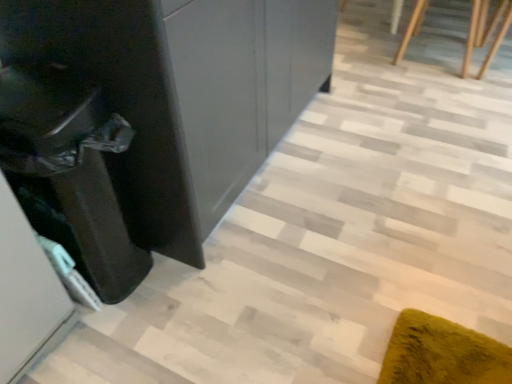
Question: Does glossy black dresser at left have a lesser height compared to wooden staircase at upper right?

Choices:
 (A) no
 (B) yes

Answer: (A)

Question: Does glossy black dresser at left turn towards wooden staircase at upper right?

Choices:
 (A) no
 (B) yes

Answer: (A)

Question: Is glossy black dresser at left closer to the viewer compared to wooden staircase at upper right?

Choices:
 (A) yes
 (B) no

Answer: (A)

Question: Is glossy black dresser at left positioned with its back to wooden staircase at upper right?

Choices:
 (A) yes
 (B) no

Answer: (B)

Question: Could wooden staircase at upper right be considered to be inside glossy black dresser at left?

Choices:
 (A) yes
 (B) no

Answer: (B)

Question: Considering the positions of point (68, 216) and point (51, 72), is point (68, 216) closer or farther from the camera than point (51, 72)?

Choices:
 (A) closer
 (B) farther

Answer: (B)

Question: Is black glossy cabinet at left wider or thinner than glossy black dresser at left?

Choices:
 (A) wide
 (B) thin

Answer: (B)

Question: From a real-world perspective, is black glossy cabinet at left physically located above or below glossy black dresser at left?

Choices:
 (A) below
 (B) above

Answer: (A)

Question: From the image's perspective, is black glossy cabinet at left located above or below glossy black dresser at left?

Choices:
 (A) below
 (B) above

Answer: (A)

Question: Is wooden staircase at upper right to the left or to the right of black glossy cabinet at left in the image?

Choices:
 (A) right
 (B) left

Answer: (A)

Question: From a real-world perspective, is wooden staircase at upper right positioned above or below black glossy cabinet at left?

Choices:
 (A) below
 (B) above

Answer: (A)

Question: Considering the positions of point (416, 24) and point (93, 203), is point (416, 24) closer or farther from the camera than point (93, 203)?

Choices:
 (A) closer
 (B) farther

Answer: (B)

Question: Considering the positions of wooden staircase at upper right and black glossy cabinet at left in the image, is wooden staircase at upper right wider or thinner than black glossy cabinet at left?

Choices:
 (A) thin
 (B) wide

Answer: (B)

Question: Is glossy black dresser at left inside or outside of wooden staircase at upper right?

Choices:
 (A) inside
 (B) outside

Answer: (B)

Question: Considering the positions of glossy black dresser at left and wooden staircase at upper right in the image, is glossy black dresser at left taller or shorter than wooden staircase at upper right?

Choices:
 (A) tall
 (B) short

Answer: (A)